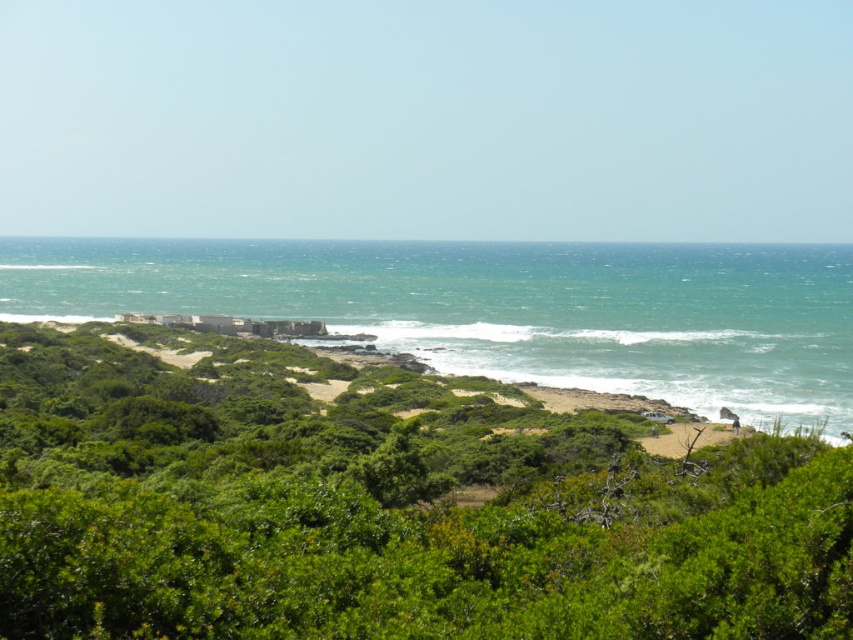
Between point (605, 561) and point (349, 291), which one is positioned in front?

Point (605, 561)

How far apart are green leafy shrubs at center and green water at center?

green leafy shrubs at center and green water at center are 83.33 meters apart from each other.

What do you see at coordinates (383, 506) in the screenshot? I see `green leafy shrubs at center` at bounding box center [383, 506].

This screenshot has height=640, width=853. Find the location of `green leafy shrubs at center`. green leafy shrubs at center is located at coordinates (383, 506).